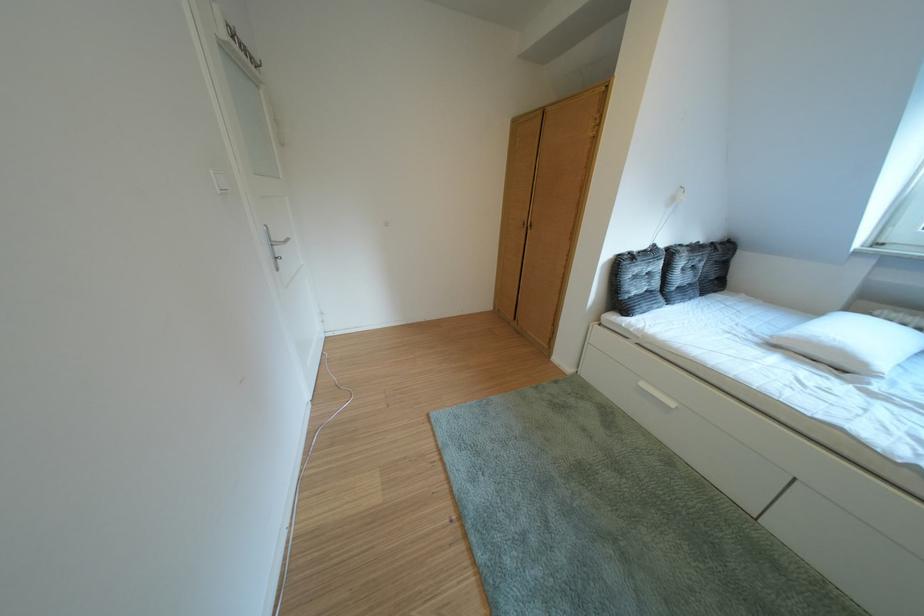
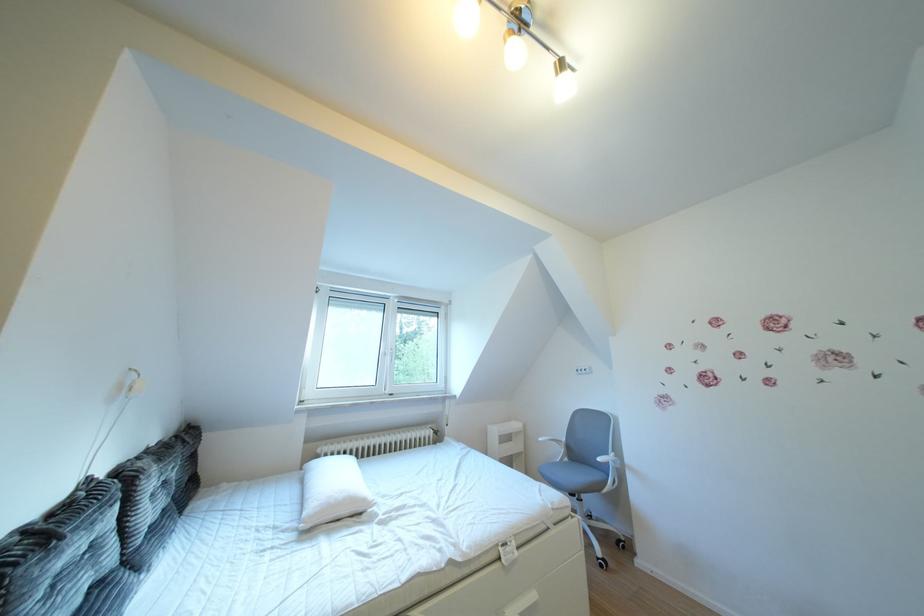
Question: The camera is either moving clockwise (left) or counter-clockwise (right) around the object. The first image is from the beginning of the video and the second image is from the end. Is the camera moving left or right when shooting the video?

Choices:
 (A) Left
 (B) Right

Answer: (A)